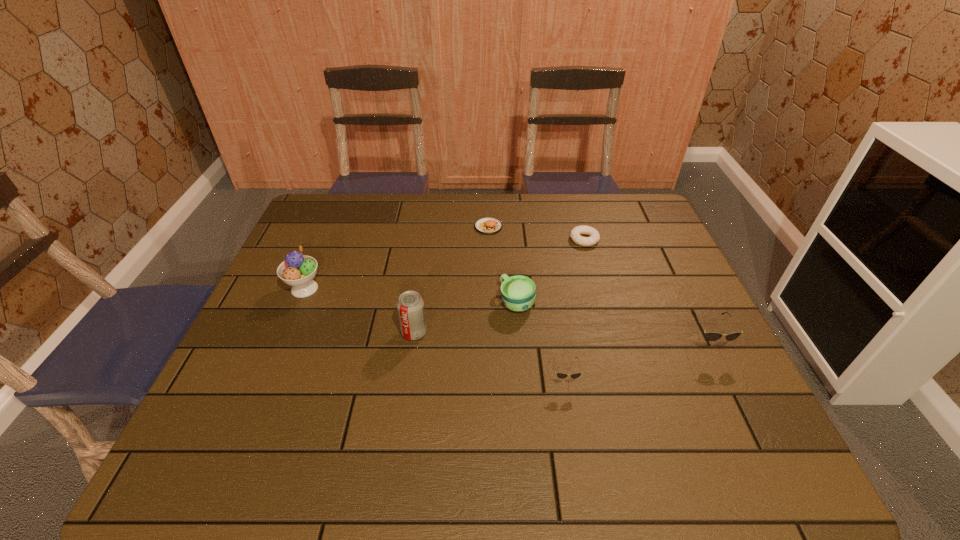
Find the location of a particular element. The height and width of the screenshot is (540, 960). object that is at the left edge is located at coordinates (298, 270).

Locate an element on the screen. The width and height of the screenshot is (960, 540). object present at the right edge is located at coordinates (711, 336).

Locate an element on the screen. This screenshot has width=960, height=540. vacant region at the far edge is located at coordinates (524, 209).

This screenshot has height=540, width=960. In the image, there is a desktop. Identify the location of vacant space at the near edge. (645, 396).

Where is `free region at the left edge of the desktop`? The height and width of the screenshot is (540, 960). free region at the left edge of the desktop is located at coordinates (276, 338).

You are a GUI agent. You are given a task and a screenshot of the screen. Output one action in this format:
    pyautogui.click(x=<x>, y=<y>)
    Task: Click on the vacant region at the right edge
    This screenshot has width=960, height=540.
    Given the screenshot: What is the action you would take?
    pyautogui.click(x=675, y=279)

In the image, there is a desktop. At what (x,y) coordinates should I click in order to perform the action: click on vacant space at the far right corner. Please return your answer as a coordinate pair (x, y). Image resolution: width=960 pixels, height=540 pixels. Looking at the image, I should click on (634, 213).

Locate an element on the screen. vacant space at the near right corner is located at coordinates (738, 419).

Locate an element on the screen. blank region between the icecream and the sixth object from left to right is located at coordinates (444, 264).

Find the location of a particular element. free spot between the patty and the icecream is located at coordinates (396, 258).